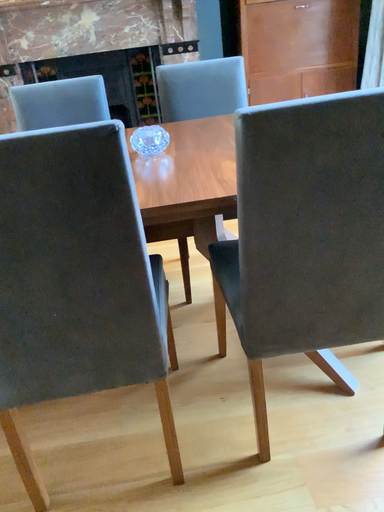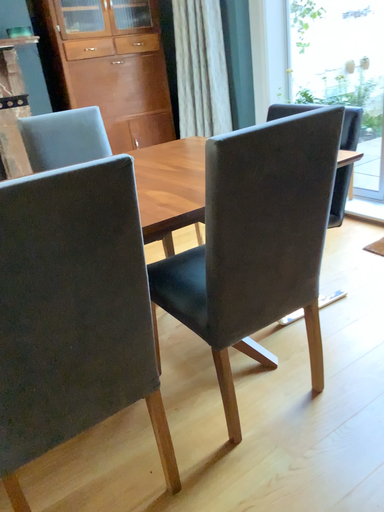
Question: How did the camera likely rotate when shooting the video?

Choices:
 (A) rotated left
 (B) rotated right

Answer: (B)